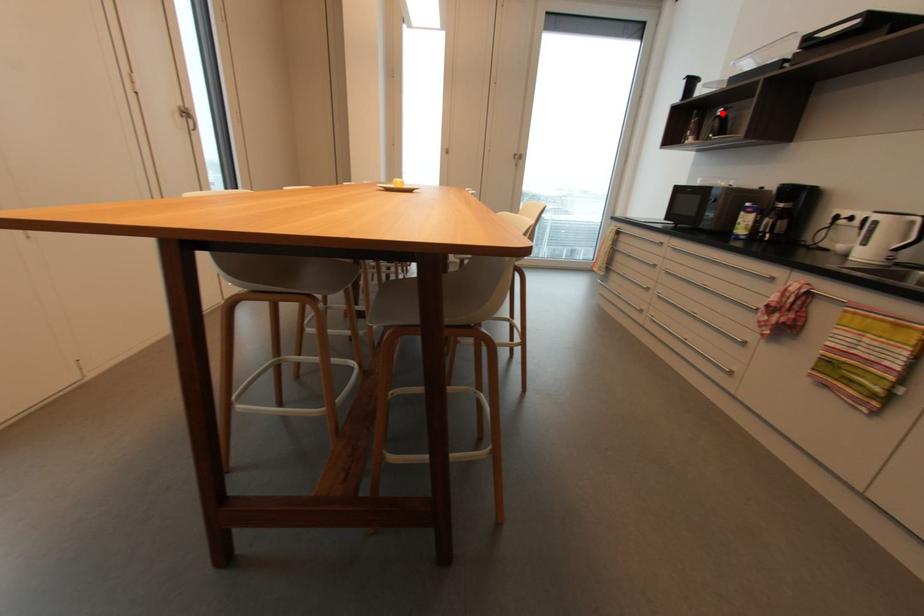
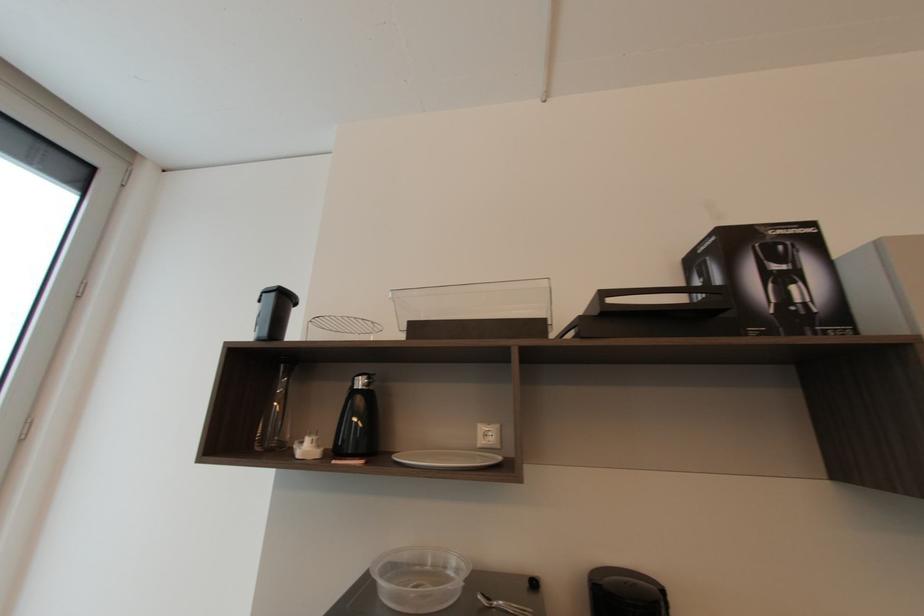
In the second image, find the point that corresponds to the highlighted location in the first image.

(362, 384)